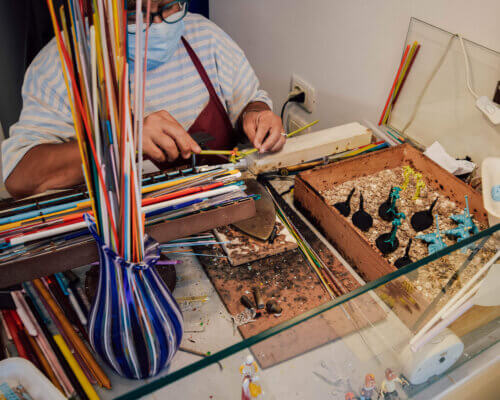
In order to click on vase in this screenshot , I will do tap(114, 337).